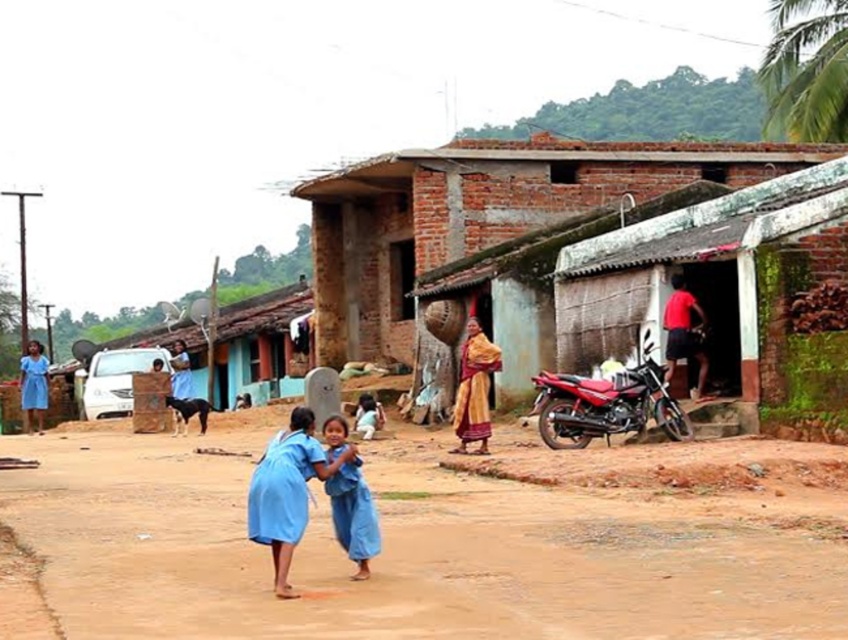
You are a delivery person trying to reach the red matte motorcycle at right parked on the rural street. There is brown sandy dirt at center blocking your path. Can you walk around it to reach the motorcycle?

The brown sandy dirt at center is in front of the red matte motorcycle at right, so you can walk around it to reach the motorcycle since the dirt is not covering the entire path.

You are a photographer standing on the dirt road and want to take a photo of the matte blue dress at left and the brown sandy dirt at center. From your perspective, which object is higher in the image?

The brown sandy dirt at center is located above the matte blue dress at left, so it appears higher in the image.